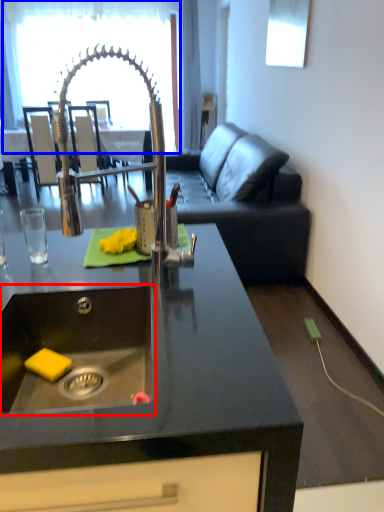
Question: Which of the following is the farthest to the observer, sink (highlighted by a red box) or glass door (highlighted by a blue box)?

Choices:
 (A) sink
 (B) glass door

Answer: (B)